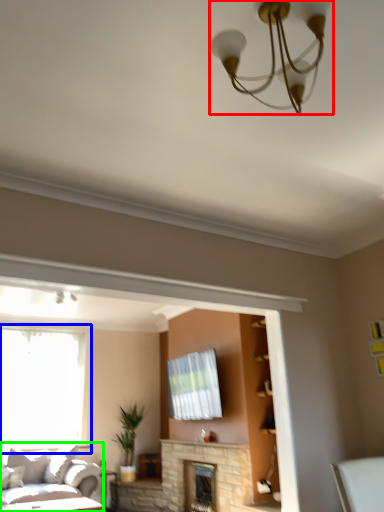
Question: Which object is the farthest from lamp (highlighted by a red box)? Choose among these: window (highlighted by a blue box) or studio couch (highlighted by a green box).

Choices:
 (A) window
 (B) studio couch

Answer: (B)